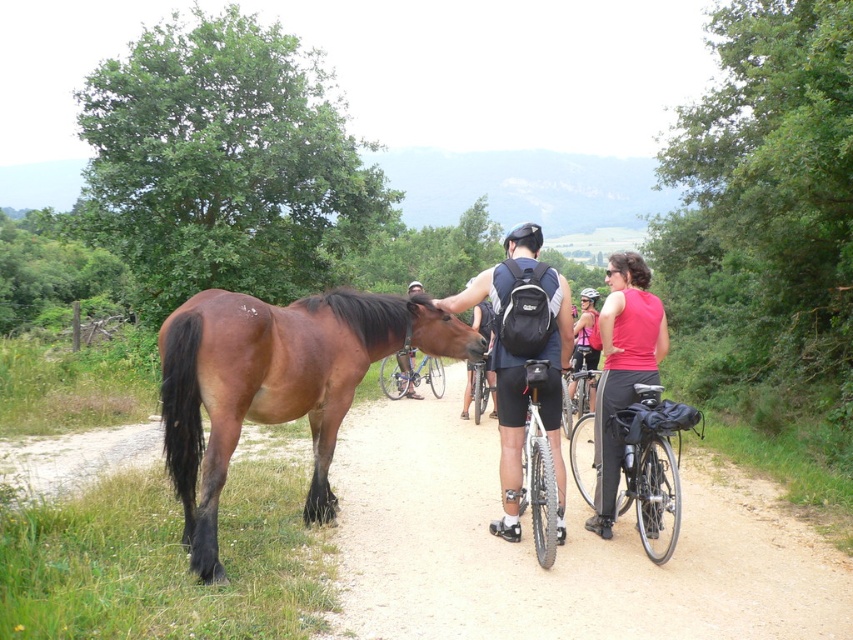
Who is taller, blue metallic bicycle at center or silver metallic bicycle at center?

blue metallic bicycle at center

Between point (418, 381) and point (483, 355), which one is positioned behind?

The point (418, 381) is behind.

The image size is (853, 640). In order to click on blue metallic bicycle at center in this screenshot , I will do `click(410, 376)`.

Can you confirm if matte pink shirt at right is positioned above black matte bicycle helmet at upper center?

Actually, matte pink shirt at right is below black matte bicycle helmet at upper center.

Between matte pink shirt at right and black matte bicycle helmet at upper center, which one appears on the right side from the viewer's perspective?

From the viewer's perspective, black matte bicycle helmet at upper center appears more on the right side.

Who is more forward, [614,257] or [583,298]?

Point [614,257] is in front.

I want to click on matte pink shirt at right, so click(x=622, y=371).

Which is more to the left, brown glossy horse at left or silver metallic bicycle at center?

brown glossy horse at left

Is brown glossy horse at left shorter than silver metallic bicycle at center?

No, brown glossy horse at left is not shorter than silver metallic bicycle at center.

Is point (198, 349) behind point (473, 381)?

No, (198, 349) is in front of (473, 381).

Locate an element on the screen. Image resolution: width=853 pixels, height=640 pixels. brown glossy horse at left is located at coordinates (276, 384).